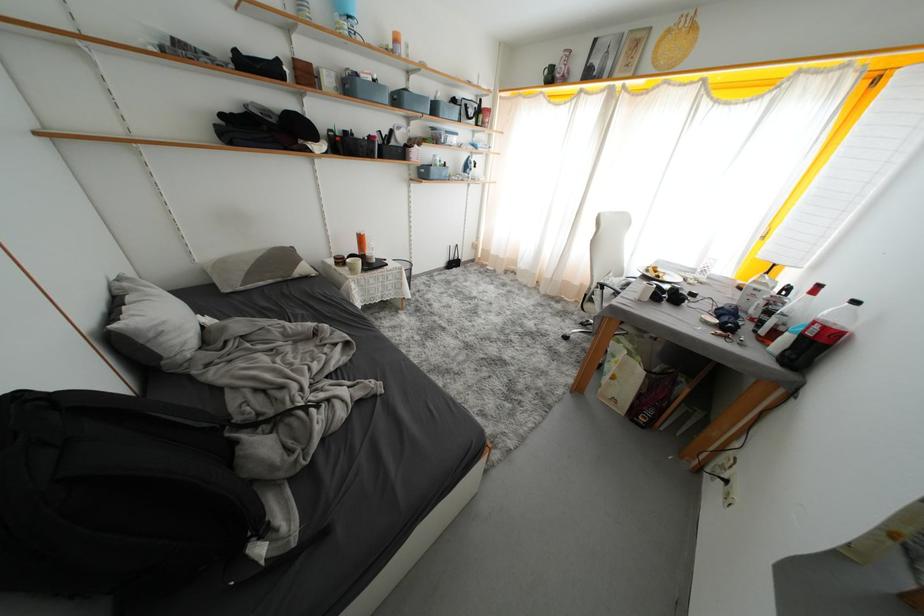
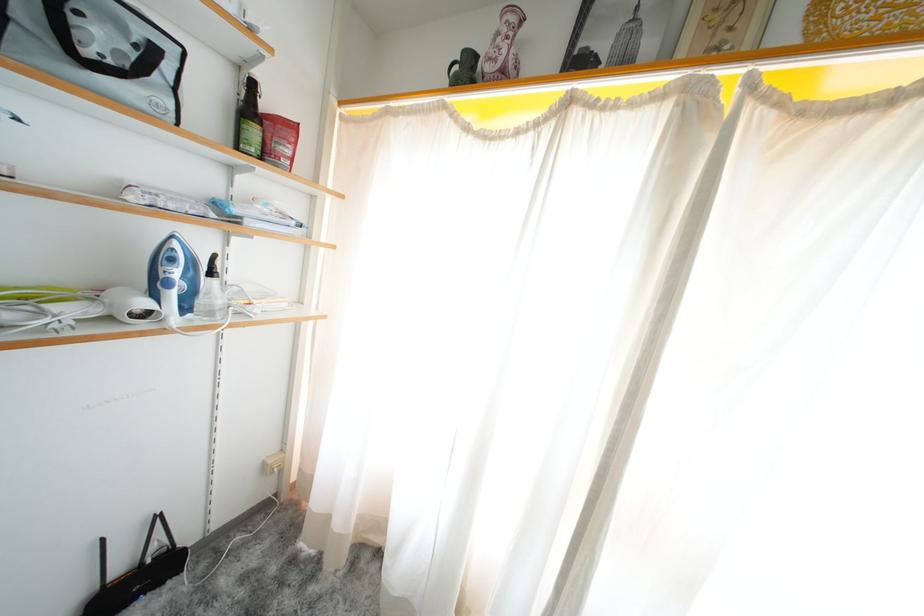
Where in the second image is the point corresponding to point 459,267 from the first image?

(143, 586)